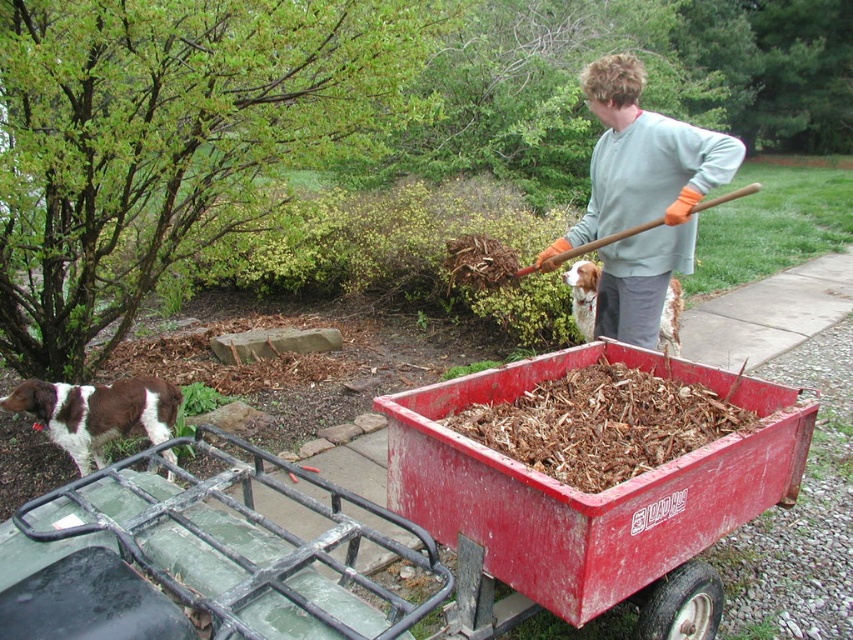
Question: Can you confirm if red plastic cart at center is thinner than brown and white fur at lower left?

Choices:
 (A) no
 (B) yes

Answer: (A)

Question: Is red plastic cart at center wider than brown speckled fur at center?

Choices:
 (A) yes
 (B) no

Answer: (A)

Question: Which object is closer to the camera taking this photo?

Choices:
 (A) light gray sweater at upper right
 (B) brown speckled fur at center

Answer: (A)

Question: Which point is farther to the camera?

Choices:
 (A) (747, 186)
 (B) (102, 388)
 (C) (477, 506)

Answer: (A)

Question: Considering the relative positions of brown and white fur at lower left and brown speckled fur at center in the image provided, where is brown and white fur at lower left located with respect to brown speckled fur at center?

Choices:
 (A) left
 (B) right

Answer: (A)

Question: Which point appears farthest from the camera in this image?

Choices:
 (A) (637, 225)
 (B) (770, 451)
 (C) (666, 308)

Answer: (C)